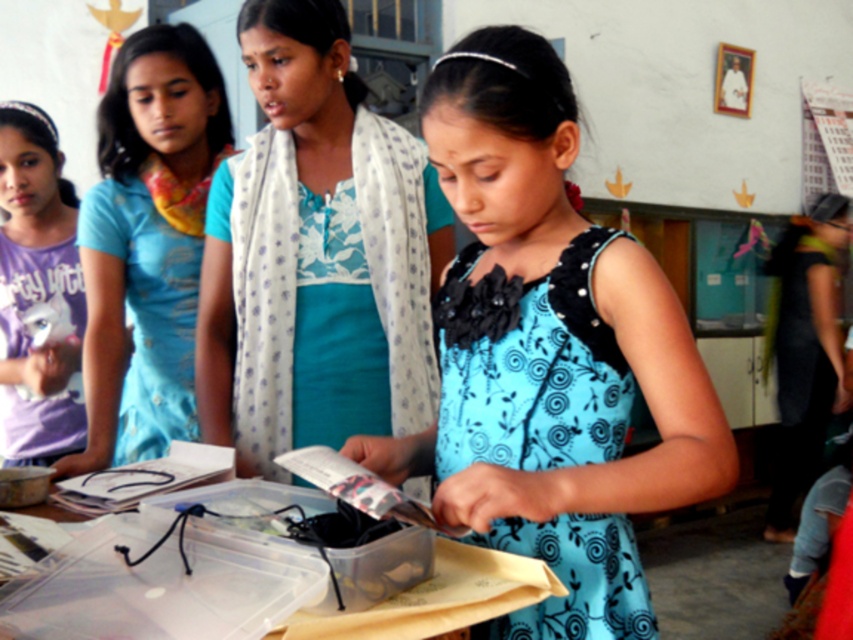
Between point (550, 557) and point (577, 538), which one is positioned in front?

Point (577, 538) is in front.

The image size is (853, 640). What do you see at coordinates (549, 353) in the screenshot? I see `blue printed dress at center` at bounding box center [549, 353].

You are a GUI agent. You are given a task and a screenshot of the screen. Output one action in this format:
    pyautogui.click(x=<x>, y=<y>)
    Task: Click on the blue printed dress at center
    
    Given the screenshot: What is the action you would take?
    pyautogui.click(x=549, y=353)

From the picture: Can you confirm if blue fabric dress at center is smaller than blue printed fabric dress at center?

Actually, blue fabric dress at center might be larger than blue printed fabric dress at center.

From the picture: Is blue fabric dress at center in front of blue printed fabric dress at center?

That is False.

Between point (242, 336) and point (438, 300), which one is positioned behind?

Point (242, 336)

The width and height of the screenshot is (853, 640). Find the location of `blue fabric dress at center`. blue fabric dress at center is located at coordinates (316, 256).

Can you confirm if blue printed dress at center is smaller than matte blue dress at left?

No, blue printed dress at center is not smaller than matte blue dress at left.

Is blue printed dress at center shorter than matte blue dress at left?

Correct, blue printed dress at center is not as tall as matte blue dress at left.

This screenshot has height=640, width=853. I want to click on blue printed dress at center, so click(549, 353).

Locate an element on the screen. This screenshot has width=853, height=640. blue printed dress at center is located at coordinates (549, 353).